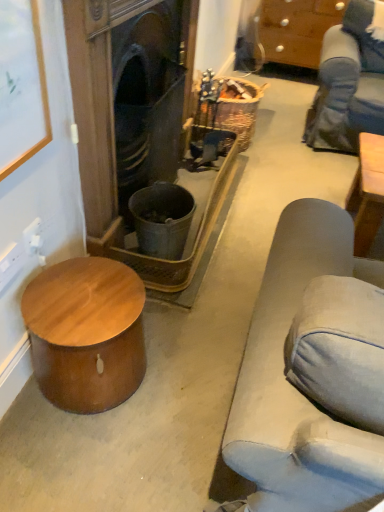
Locate an element on the screen. free point to the right of dark wood fireplace at center is located at coordinates 265,201.